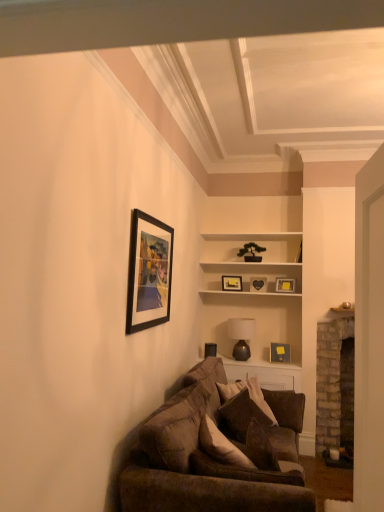
What do you see at coordinates (245, 401) in the screenshot? The width and height of the screenshot is (384, 512). I see `brown velvety pillow at center` at bounding box center [245, 401].

What are the coordinates of `brown velvety pillow at center` in the screenshot? It's located at (245, 401).

Where is `white wood shelf at upper center`? This screenshot has height=512, width=384. white wood shelf at upper center is located at coordinates (251, 262).

Describe the element at coordinates (285, 285) in the screenshot. The width and height of the screenshot is (384, 512). I see `matte yellow picture frame at upper right, marked as the 1th picture frame in a right-to-left arrangement` at that location.

How much space does matte black picture frame at upper left, which ranks as the 3th picture frame in back-to-front order, occupy horizontally?

3.49 inches.

The height and width of the screenshot is (512, 384). I want to click on matte black picture frame at upper left, which is the 6th picture frame in top-to-bottom order, so click(210, 350).

What is the approximate height of matte black picture frame at upper center, acting as the fifth picture frame starting from the front?

It is 7.87 inches.

In order to click on matte brown lamp at center in this screenshot , I will do `click(241, 336)`.

The height and width of the screenshot is (512, 384). Identify the location of brick fireplace at right. (329, 380).

Locate an element on the screen. black matte picture frame at upper left, placed as the 6th picture frame when sorted from back to front is located at coordinates (149, 272).

Can you confirm if matte black picture frame at upper center, which is counted as the 2th picture frame, starting from the top, is shorter than white wood shelf at upper center?

Correct, matte black picture frame at upper center, which is counted as the 2th picture frame, starting from the top, is not as tall as white wood shelf at upper center.

Considering the sizes of objects matte black picture frame at upper center, the second picture frame from the back, and white wood shelf at upper center in the image provided, who is smaller, matte black picture frame at upper center, the second picture frame from the back, or white wood shelf at upper center?

With smaller size is matte black picture frame at upper center, the second picture frame from the back.

From the image's perspective, which object appears higher, matte black picture frame at upper center, placed as the 3th picture frame when sorted from right to left, or white wood shelf at upper center?

white wood shelf at upper center.

Consider the image. From a real-world perspective, is matte black picture frame at upper center, which is the 4th picture frame from left to right, positioned above or below white wood shelf at upper center?

matte black picture frame at upper center, which is the 4th picture frame from left to right, is situated lower than white wood shelf at upper center in the real world.

Which is more to the right, matte black picture frame at upper left, which is the 6th picture frame in top-to-bottom order, or velvet brown couch at lower center?

velvet brown couch at lower center.

Where is `the 1st picture frame counting from the left side of the velvet brown couch at lower center`? the 1st picture frame counting from the left side of the velvet brown couch at lower center is located at coordinates (210, 350).

From a real-world perspective, is matte black picture frame at upper left, the 1th picture frame when ordered from bottom to top, above or below velvet brown couch at lower center?

In terms of real-world spatial position, matte black picture frame at upper left, the 1th picture frame when ordered from bottom to top, is above velvet brown couch at lower center.

Can you confirm if matte black picture frame at upper left, the 5th picture frame positioned from the right, is smaller than velvet brown couch at lower center?

Yes, matte black picture frame at upper left, the 5th picture frame positioned from the right, is smaller than velvet brown couch at lower center.

How different are the orientations of brick fireplace at right and matte black picture frame at upper center, arranged as the fifth picture frame when viewed from the top, in degrees?

brick fireplace at right and matte black picture frame at upper center, arranged as the fifth picture frame when viewed from the top, are facing 0.248 degrees away from each other.

This screenshot has height=512, width=384. Identify the location of fireplace to the right of matte black picture frame at upper center, arranged as the fifth picture frame when viewed from the top. (329, 380).

Is brick fireplace at right beside matte black picture frame at upper center, arranged as the 4th picture frame when viewed from the back?

No, brick fireplace at right is not touching matte black picture frame at upper center, arranged as the 4th picture frame when viewed from the back.

Which of these two, brick fireplace at right or matte black picture frame at upper center, which appears as the 2th picture frame when viewed from the right, stands shorter?

With less height is matte black picture frame at upper center, which appears as the 2th picture frame when viewed from the right.

From the image's perspective, between brown velvety pillow at center and black matte picture frame at upper left, the sixth picture frame positioned from the bottom, who is located below?

brown velvety pillow at center is shown below in the image.

Is point (266, 414) positioned before point (151, 321)?

No, (266, 414) is further to viewer.

Could you tell me if brown velvety pillow at center is turned towards black matte picture frame at upper left, marked as the sixth picture frame in a right-to-left arrangement?

No, brown velvety pillow at center is not facing towards black matte picture frame at upper left, marked as the sixth picture frame in a right-to-left arrangement.

Which object is positioned more to the right, matte yellow picture frame at upper right, placed as the 5th picture frame when sorted from back to front, or white wood shelf at upper center?

matte yellow picture frame at upper right, placed as the 5th picture frame when sorted from back to front.

Between point (293, 279) and point (244, 288), which one is positioned behind?

Positioned behind is point (244, 288).

Based on their sizes in the image, would you say matte yellow picture frame at upper right, marked as the 1th picture frame in a right-to-left arrangement, is bigger or smaller than white wood shelf at upper center?

In the image, matte yellow picture frame at upper right, marked as the 1th picture frame in a right-to-left arrangement, appears to be smaller than white wood shelf at upper center.

What's the angular difference between matte yellow picture frame at upper right, placed as the sixth picture frame when sorted from left to right, and white wood shelf at upper center's facing directions?

There is a 18.9-degree angle between the facing directions of matte yellow picture frame at upper right, placed as the sixth picture frame when sorted from left to right, and white wood shelf at upper center.

From the image's perspective, between brick fireplace at right and black matte picture frame at upper left, placed as the 6th picture frame when sorted from back to front, who is located below?

brick fireplace at right, from the image's perspective.

Is brick fireplace at right oriented away from black matte picture frame at upper left, arranged as the first picture frame when viewed from the front?

That's not correct — brick fireplace at right is not looking away from black matte picture frame at upper left, arranged as the first picture frame when viewed from the front.

From a real-world perspective, between brick fireplace at right and black matte picture frame at upper left, placed as the 6th picture frame when sorted from back to front, who is vertically lower?

brick fireplace at right is physically lower.

Based on the photo, is brick fireplace at right not within black matte picture frame at upper left, arranged as the first picture frame when viewed from the front?

That's correct, brick fireplace at right is outside of black matte picture frame at upper left, arranged as the first picture frame when viewed from the front.

From the image's perspective, who appears lower, matte black picture frame at upper center, which is the 4th picture frame from left to right, or matte black picture frame at upper center, the second picture frame from the bottom?

matte black picture frame at upper center, the second picture frame from the bottom, is shown below in the image.

Would you say matte black picture frame at upper center, placed as the 3th picture frame when sorted from right to left, is to the left or to the right of matte black picture frame at upper center, arranged as the fifth picture frame when viewed from the top, in the picture?

Clearly, matte black picture frame at upper center, placed as the 3th picture frame when sorted from right to left, is on the left of matte black picture frame at upper center, arranged as the fifth picture frame when viewed from the top, in the image.

Is matte black picture frame at upper center, which is the 4th picture frame from left to right, aimed at matte black picture frame at upper center, arranged as the fifth picture frame when viewed from the top?

No, matte black picture frame at upper center, which is the 4th picture frame from left to right, is not turned towards matte black picture frame at upper center, arranged as the fifth picture frame when viewed from the top.

Is matte black picture frame at upper center, acting as the fifth picture frame starting from the front, surrounding matte black picture frame at upper center, the 3th picture frame positioned from the front?

No, matte black picture frame at upper center, the 3th picture frame positioned from the front, is not inside matte black picture frame at upper center, acting as the fifth picture frame starting from the front.

Where is `the 4th picture frame behind when counting from the white wood shelf at upper center`? the 4th picture frame behind when counting from the white wood shelf at upper center is located at coordinates (258, 284).

Starting from the velvet brown couch at lower center, which picture frame is the 1st one to the left? Please provide its 2D coordinates.

[(210, 350)]

Considering their positions, is matte black picture frame at upper center, the second picture frame from the bottom, positioned further to brown velvety pillow at center than matte gray picture frame at upper center, which is the 3th picture frame from top to bottom?

Based on the image, matte gray picture frame at upper center, which is the 3th picture frame from top to bottom, appears to be further to brown velvety pillow at center.

Consider the image. Estimate the real-world distances between objects in this image. Which object is closer to brick fireplace at right, brown velvety pillow at center or matte yellow picture frame at upper right, marked as the 1th picture frame in a right-to-left arrangement?

Among the two, matte yellow picture frame at upper right, marked as the 1th picture frame in a right-to-left arrangement, is located nearer to brick fireplace at right.

Estimate the real-world distances between objects in this image. Which object is closer to white wood shelf at upper center, matte brown lamp at center or matte gray picture frame at upper center, which is the 3th picture frame from top to bottom?

Based on the image, matte gray picture frame at upper center, which is the 3th picture frame from top to bottom, appears to be nearer to white wood shelf at upper center.

Estimate the real-world distances between objects in this image. Which object is closer to matte gray picture frame at upper center, which is the fourth picture frame from bottom to top, matte black picture frame at upper left, which is the 6th picture frame in top-to-bottom order, or matte brown lamp at center?

matte brown lamp at center is positioned closer to the anchor matte gray picture frame at upper center, which is the fourth picture frame from bottom to top.

Looking at the image, which one is located further to matte black picture frame at upper left, marked as the 4th picture frame in a front-to-back arrangement, brick fireplace at right or matte yellow picture frame at upper right, marked as the 1th picture frame in a right-to-left arrangement?

brick fireplace at right.

From the image, which object appears to be farther from matte yellow picture frame at upper right, placed as the 5th picture frame when sorted from back to front, white wood shelf at upper center or matte black picture frame at upper center, the 3th picture frame positioned from the front?

Based on the image, matte black picture frame at upper center, the 3th picture frame positioned from the front, appears to be further to matte yellow picture frame at upper right, placed as the 5th picture frame when sorted from back to front.

From the image, which object appears to be nearer to matte gray picture frame at upper center, the sixth picture frame positioned from the front, brown velvety pillow at center or matte black picture frame at upper left, which ranks as the 3th picture frame in back-to-front order?

matte black picture frame at upper left, which ranks as the 3th picture frame in back-to-front order, lies closer to matte gray picture frame at upper center, the sixth picture frame positioned from the front, than the other object.

Which object lies nearer to the anchor point matte black picture frame at upper left, marked as the 4th picture frame in a front-to-back arrangement, black matte picture frame at upper left, the sixth picture frame positioned from the bottom, or velvet brown couch at lower center?

Based on the image, velvet brown couch at lower center appears to be nearer to matte black picture frame at upper left, marked as the 4th picture frame in a front-to-back arrangement.

In order to click on lamp between velvet brown couch at lower center and matte black picture frame at upper center, acting as the fifth picture frame starting from the front, from front to back in this screenshot , I will do `click(241, 336)`.

At what (x,y) coordinates should I click in order to perform the action: click on lamp located between matte black picture frame at upper left, the 5th picture frame positioned from the right, and matte yellow picture frame at upper right, the fourth picture frame when ordered from top to bottom, in the left-right direction. Please return your answer as a coordinate pair (x, y). The height and width of the screenshot is (512, 384). Looking at the image, I should click on (241, 336).

At what (x,y) coordinates should I click in order to perform the action: click on picture frame between matte gray picture frame at upper center, which is the fourth picture frame from bottom to top, and matte black picture frame at upper center, arranged as the fifth picture frame when viewed from the top, vertically. Please return your answer as a coordinate pair (x, y). The image size is (384, 512). Looking at the image, I should click on (285, 285).

Locate an element on the screen. shelf between black matte picture frame at upper left, marked as the sixth picture frame in a right-to-left arrangement, and matte black picture frame at upper center, the second picture frame from the back, in the front-back direction is located at coordinates (251, 262).